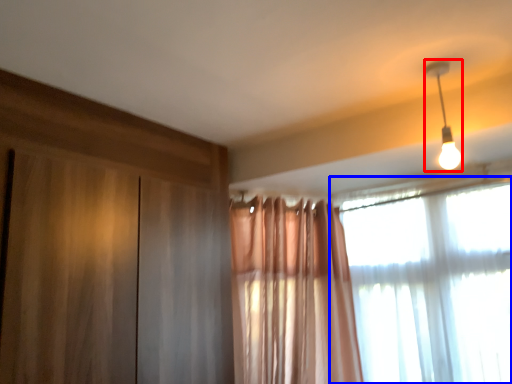
Question: Which of the following is the closest to the observer, lamp (highlighted by a red box) or window (highlighted by a blue box)?

Choices:
 (A) lamp
 (B) window

Answer: (A)